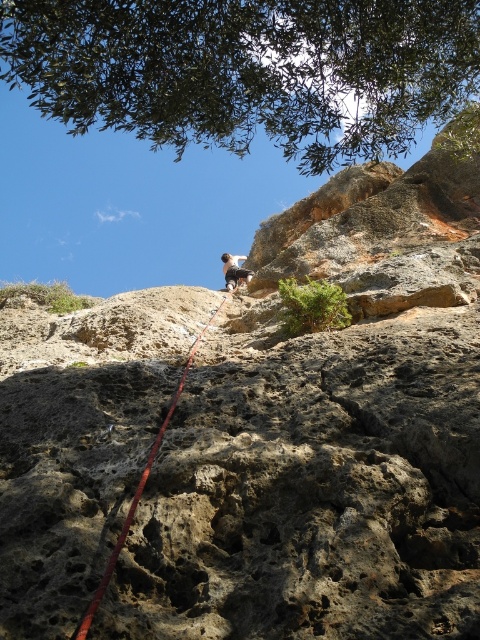
In the scene shown: You are a rock climber preparing to ascend a steep cliff. You notice the red nylon rope at center and the white fabric rock climber at upper center. Which object is thinner in width?

The red nylon rope at center is thinner in width than the white fabric rock climber at upper center.

You are a photographer standing at the base of the cliff, aiming to capture the climber using a camera with a 100mm lens. The camera can focus on objects up to 15 feet away. Is the point at coordinates point (371,96) within the camera focus range?

The point at coordinates point (371,96) is 15.24 feet from the camera. Since the camera can focus up to 15 feet, the point is slightly beyond the focus range and cannot be captured clearly.